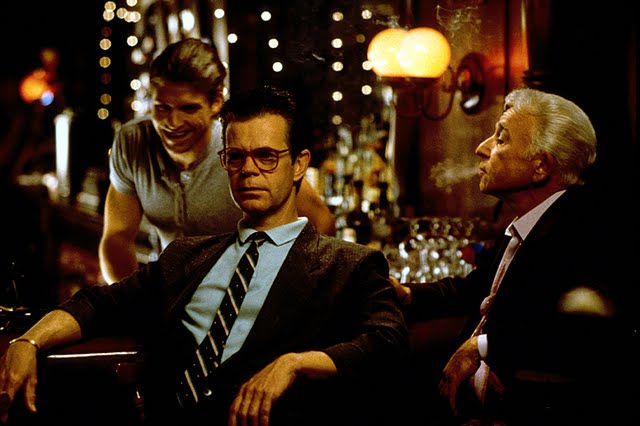
Locate an element on the screen. The height and width of the screenshot is (426, 640). wine glasses is located at coordinates (x=451, y=265), (x=438, y=234), (x=436, y=276).